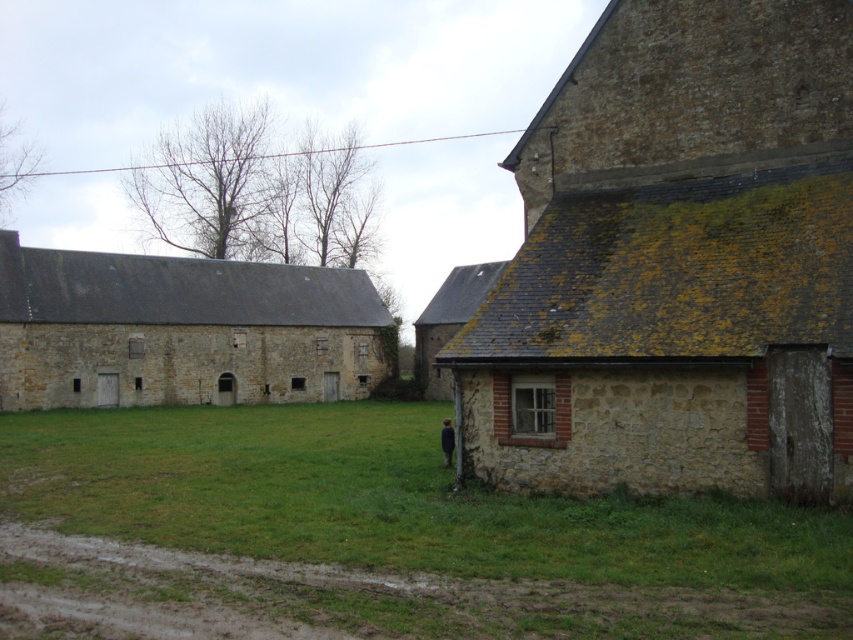
Does point (740, 112) come closer to viewer compared to point (595, 634)?

No, it is not.

Can you confirm if stone textured barn at right is positioned to the left of green grass at center?

In fact, stone textured barn at right is to the right of green grass at center.

Does point (492, 396) come farther from viewer compared to point (218, 438)?

No, it is not.

Identify the location of stone textured barn at right. (677, 262).

Who is lower down, green grass at center or stone barn at left?

green grass at center

What do you see at coordinates (372, 538) in the screenshot?
I see `green grass at center` at bounding box center [372, 538].

This screenshot has height=640, width=853. In order to click on green grass at center in this screenshot , I will do `click(372, 538)`.

Which is in front, point (560, 259) or point (61, 394)?

Point (560, 259) is more forward.

Which of these two, stone textured barn at right or stone barn at left, stands shorter?

Standing shorter between the two is stone barn at left.

Between point (756, 45) and point (245, 300), which one is positioned in front?

Point (756, 45)

I want to click on stone textured barn at right, so click(677, 262).